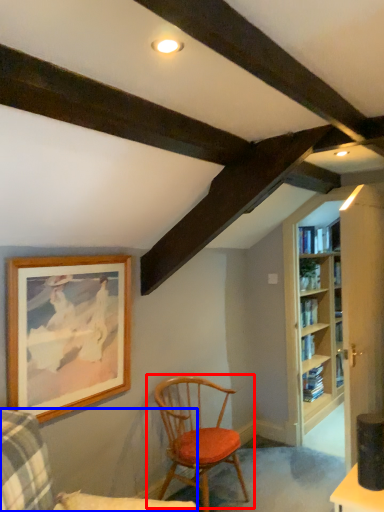
Question: Which object appears farthest to the camera in this image, chair (highlighted by a red box) or chair (highlighted by a blue box)?

Choices:
 (A) chair
 (B) chair

Answer: (A)